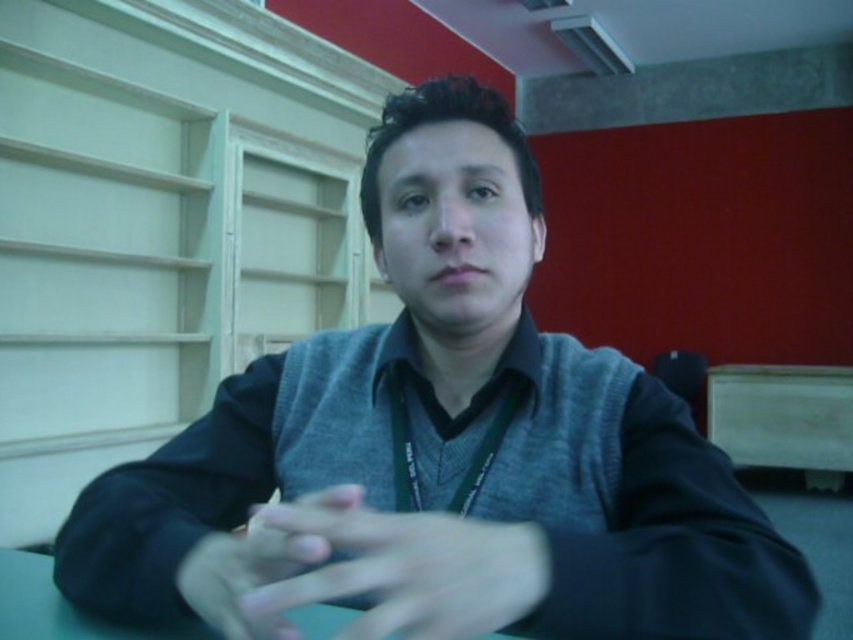
You are a photographer setting up a shot of the scene. You need to ensure the smooth skin hand at center and the green matte table at center are both in focus. Since the hand is closer to the camera, will it appear larger than the table in the photo?

The smooth skin hand at center is positioned on the right side of the green matte table at center. Since the hand is closer to the camera, it will appear larger than the table in the photo.

You are a photographer setting up a portrait shoot in this room. You need to ensure that the matte gray hand at center and the green matte table at center are both in focus. Given their sizes, which object should you adjust your camera settings to prioritize focusing on first?

The matte gray hand at center is smaller than the green matte table at center, so you should prioritize focusing on the green matte table at center first because larger objects often require more precise focus adjustments to ensure sharpness across their entire surface.

You are a photographer setting up a portrait session in the room described. You have a camera that can focus on objects up to 1 meter tall. The subject will be seated at the green matte table at center. Will the smooth skin hand at center be within the camera focus range?

The smooth skin hand at center is taller than the green matte table at center. Since the camera can focus on objects up to 1 meter tall, we need to determine the hand and table heights. If the table is shorter than 1m, the hand being taller might exceed the focus range. However, without exact measurements, we can only state the relationship between them. The hand is taller than the table, so if the table is under 1m, the hand could be out of range. But since the scene shows both at center, likely within the